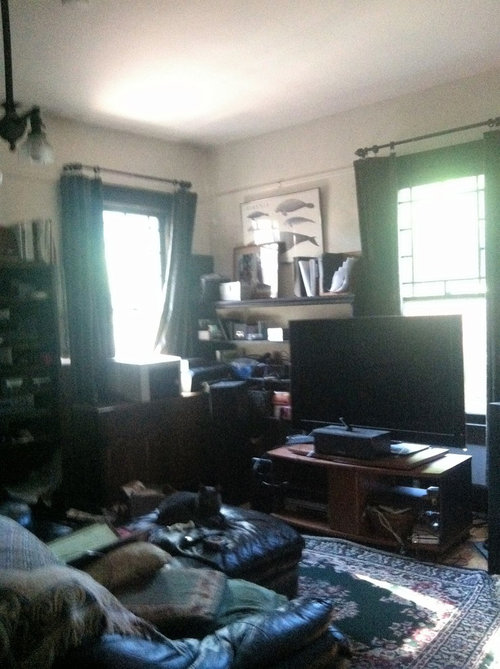
The image size is (500, 669). I want to click on green decor pillows, so click(x=227, y=599), click(x=164, y=599).